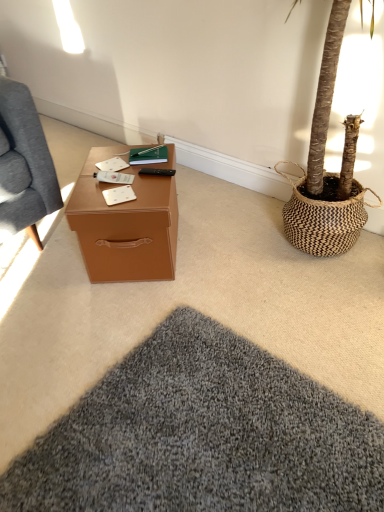
You are a GUI agent. You are given a task and a screenshot of the screen. Output one action in this format:
    pyautogui.click(x=<x>, y=<y>)
    Task: Click on the free spot above soft gray carpet at center (from a real-world perspective)
    This screenshot has width=384, height=512.
    Given the screenshot: What is the action you would take?
    pyautogui.click(x=159, y=315)